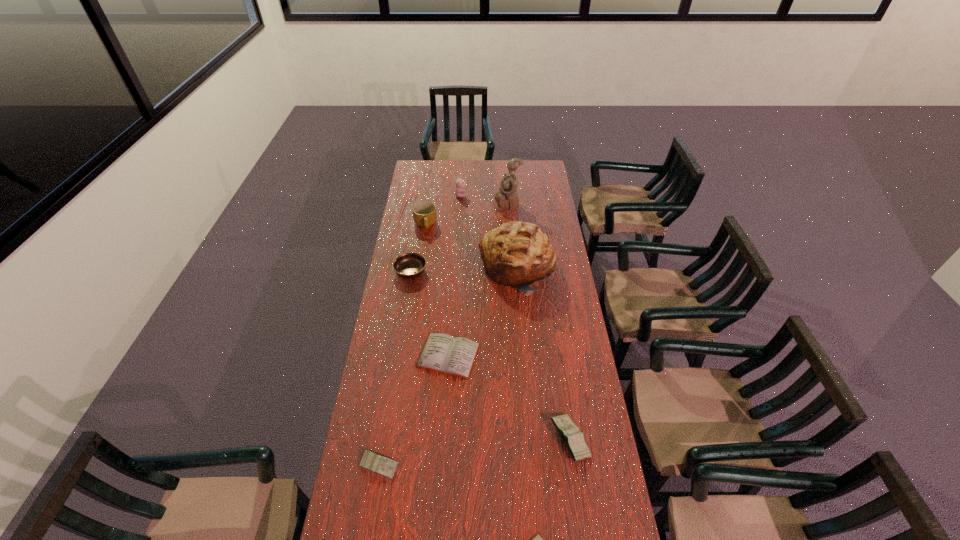
At what (x,y) coordinates should I click in order to perform the action: click on free space located on the back of the bigger pink diary. Please return your answer as a coordinate pair (x, y). Looking at the image, I should click on (556, 345).

The image size is (960, 540). I want to click on free region located 0.110m on the right of the seventh tallest object, so click(x=433, y=465).

The height and width of the screenshot is (540, 960). I want to click on vacant space located on the back of the bigger white diary, so click(x=453, y=275).

Find the location of a particular element. This screenshot has width=960, height=540. mug present at the left edge is located at coordinates (424, 213).

Find the location of `soup bowl present at the left edge`. soup bowl present at the left edge is located at coordinates (410, 265).

I want to click on diary at the left edge, so click(375, 462).

Locate an element on the screen. The image size is (960, 540). bread that is positioned at the right edge is located at coordinates coord(516,254).

Find the location of `diary positioned at the right edge`. diary positioned at the right edge is located at coordinates (574, 441).

Locate an element on the screen. This screenshot has width=960, height=540. free region at the far edge of the desktop is located at coordinates (477, 163).

In the image, there is a desktop. Where is `vacant space at the left edge`? This screenshot has height=540, width=960. vacant space at the left edge is located at coordinates (407, 324).